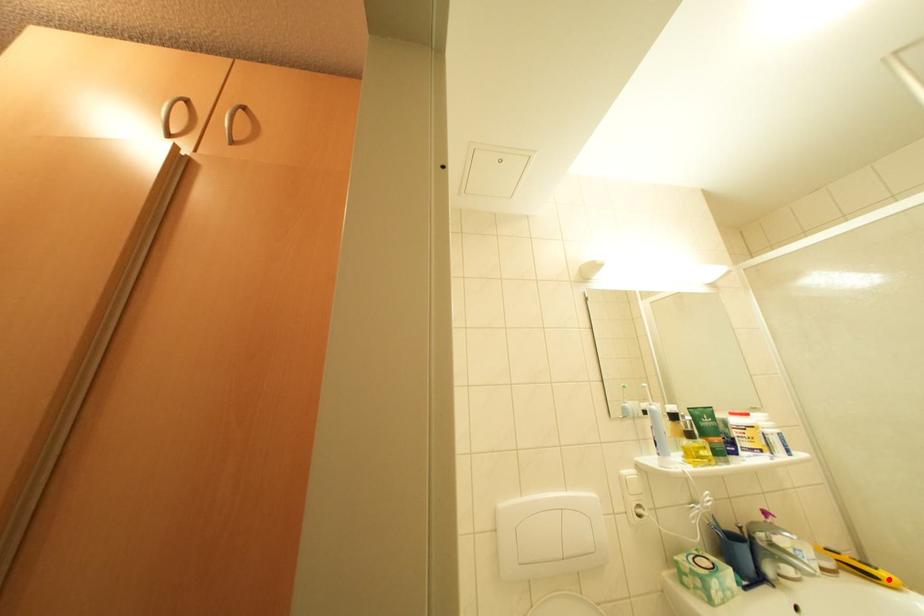
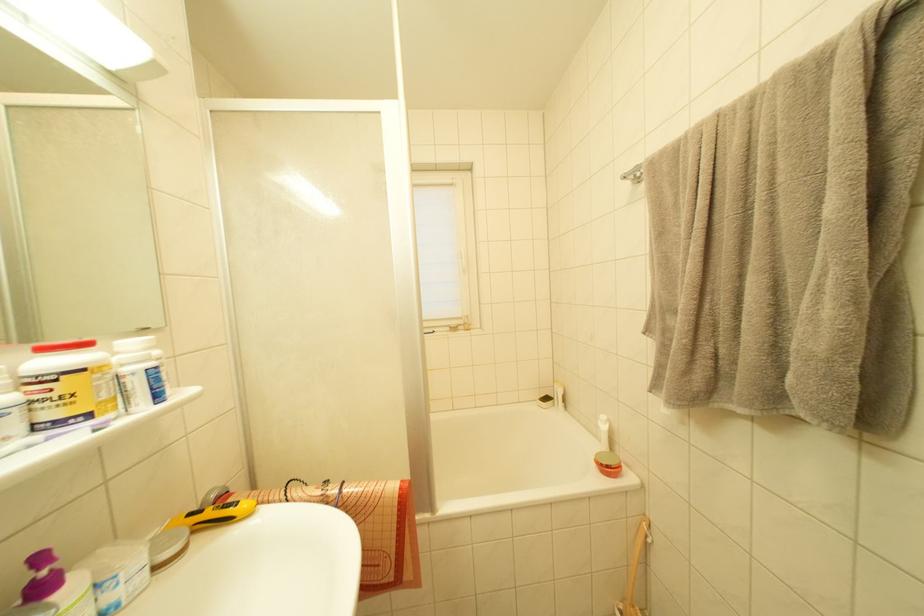
The point at the highlighted location is marked in the first image. Where is the corresponding point in the second image?

(248, 511)